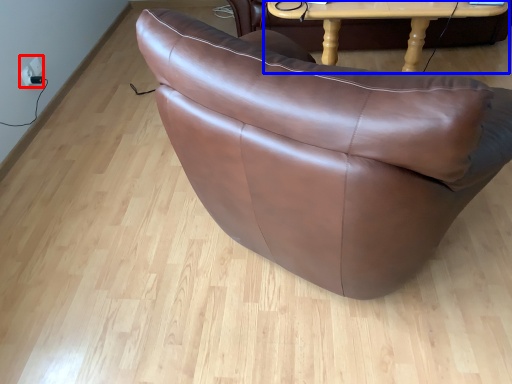
Question: Which object appears closest to the camera in this image, electric outlet (highlighted by a red box) or table (highlighted by a blue box)?

Choices:
 (A) electric outlet
 (B) table

Answer: (B)